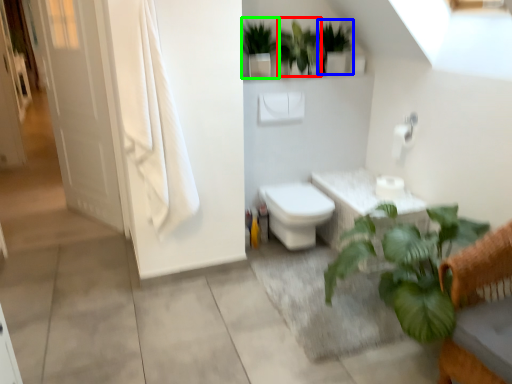
Question: Which object is positioned farthest from vegetation (highlighted by a red box)? Select from vegetation (highlighted by a blue box) and vegetation (highlighted by a green box).

Choices:
 (A) vegetation
 (B) vegetation

Answer: (B)